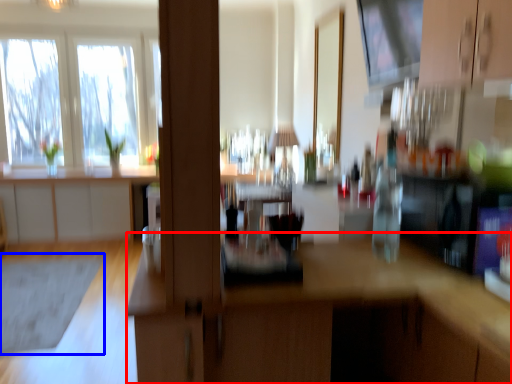
Question: Which point is closer to the camera, computer desk (highlighted by a red box) or mat (highlighted by a blue box)?

Choices:
 (A) computer desk
 (B) mat

Answer: (A)